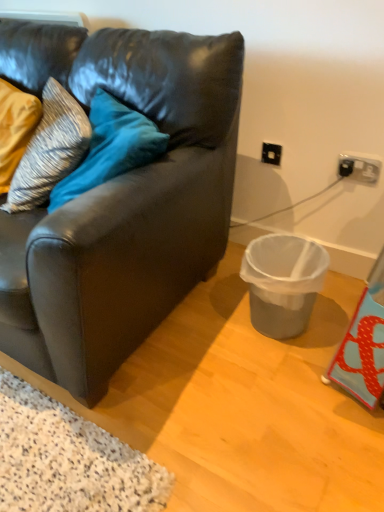
Question: Is gray plastic trash can at lower right bigger than striped fabric pillow at left?

Choices:
 (A) yes
 (B) no

Answer: (B)

Question: Is gray plastic trash can at lower right at the right side of striped fabric pillow at left?

Choices:
 (A) no
 (B) yes

Answer: (B)

Question: Is gray plastic trash can at lower right not near striped fabric pillow at left?

Choices:
 (A) no
 (B) yes

Answer: (A)

Question: Does gray plastic trash can at lower right lie behind striped fabric pillow at left?

Choices:
 (A) no
 (B) yes

Answer: (A)

Question: Does gray plastic trash can at lower right lie in front of striped fabric pillow at left?

Choices:
 (A) no
 (B) yes

Answer: (B)

Question: Can you confirm if gray plastic trash can at lower right is shorter than striped fabric pillow at left?

Choices:
 (A) no
 (B) yes

Answer: (B)

Question: Can you confirm if matte black couch at center is smaller than striped fabric pillow at left?

Choices:
 (A) yes
 (B) no

Answer: (B)

Question: Does matte black couch at center appear on the left side of striped fabric pillow at left?

Choices:
 (A) yes
 (B) no

Answer: (B)

Question: Is matte black couch at center in front of striped fabric pillow at left?

Choices:
 (A) yes
 (B) no

Answer: (A)

Question: Could you tell me if matte black couch at center is facing striped fabric pillow at left?

Choices:
 (A) yes
 (B) no

Answer: (A)

Question: Is matte black couch at center completely or partially outside of striped fabric pillow at left?

Choices:
 (A) yes
 (B) no

Answer: (A)

Question: Considering the relative sizes of matte black couch at center and striped fabric pillow at left in the image provided, is matte black couch at center wider than striped fabric pillow at left?

Choices:
 (A) yes
 (B) no

Answer: (A)

Question: Can you confirm if gray plastic trash can at lower right is taller than matte black couch at center?

Choices:
 (A) yes
 (B) no

Answer: (B)